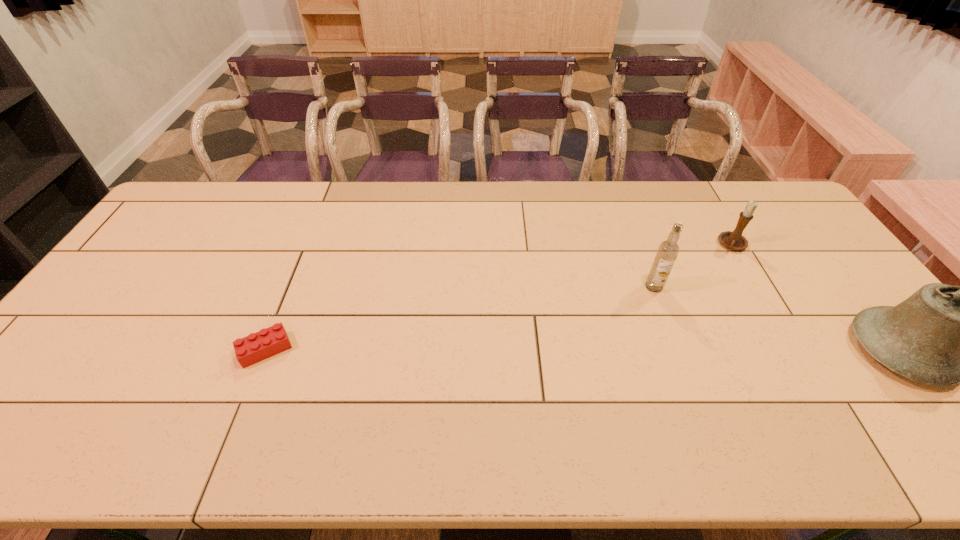
Locate an element on the screen. The image size is (960, 540). the leftmost object is located at coordinates (256, 347).

Where is `the shortest object`? The width and height of the screenshot is (960, 540). the shortest object is located at coordinates (256, 347).

The width and height of the screenshot is (960, 540). I want to click on the second farthest object, so click(x=668, y=250).

Locate an element on the screen. This screenshot has width=960, height=540. the third object from right to left is located at coordinates coord(668,250).

I want to click on the second shortest object, so click(734, 240).

What are the coordinates of `the second object from right to left` in the screenshot? It's located at (734, 240).

In order to click on blank space located on the front of the shortest object in this screenshot , I will do `click(249, 390)`.

The height and width of the screenshot is (540, 960). I want to click on vacant space located 0.310m on the label of the second farthest object, so click(x=598, y=364).

Image resolution: width=960 pixels, height=540 pixels. In order to click on free region located 0.370m on the label of the second farthest object in this screenshot , I will do `click(587, 380)`.

You are a GUI agent. You are given a task and a screenshot of the screen. Output one action in this format:
    pyautogui.click(x=<x>, y=<y>)
    Task: Click on the vacant area situated on the label of the second farthest object
    Image resolution: width=960 pixels, height=540 pixels.
    Given the screenshot: What is the action you would take?
    pyautogui.click(x=613, y=343)